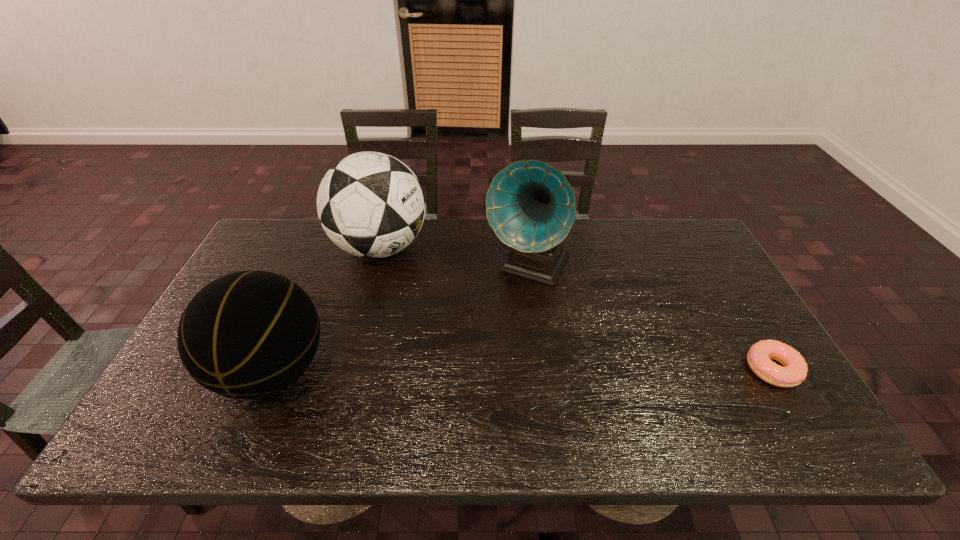
What are the coordinates of `basketball` in the screenshot? It's located at (250, 334).

This screenshot has height=540, width=960. In order to click on doughnut in this screenshot , I will do `click(794, 371)`.

Where is `the shortest object`? the shortest object is located at coordinates (794, 371).

The height and width of the screenshot is (540, 960). What are the coordinates of `the tallest object` in the screenshot? It's located at (530, 205).

At what (x,y) coordinates should I click in order to perform the action: click on the second object from right to left. Please return your answer as a coordinate pair (x, y). This screenshot has height=540, width=960. Looking at the image, I should click on (530, 205).

Identify the location of soccer ball. The height and width of the screenshot is (540, 960). (371, 205).

The height and width of the screenshot is (540, 960). Identify the location of vacant space located 0.120m on the right of the basketball. (379, 372).

Where is `vacant space located 0.160m on the left of the doughnut`? vacant space located 0.160m on the left of the doughnut is located at coordinates (681, 369).

At what (x,y) coordinates should I click in order to perform the action: click on free spot located from the horn of the tallest object. Please return your answer as a coordinate pair (x, y). This screenshot has height=540, width=960. Looking at the image, I should click on (492, 333).

Locate an element on the screen. free space located 0.050m from the horn of the tallest object is located at coordinates (507, 308).